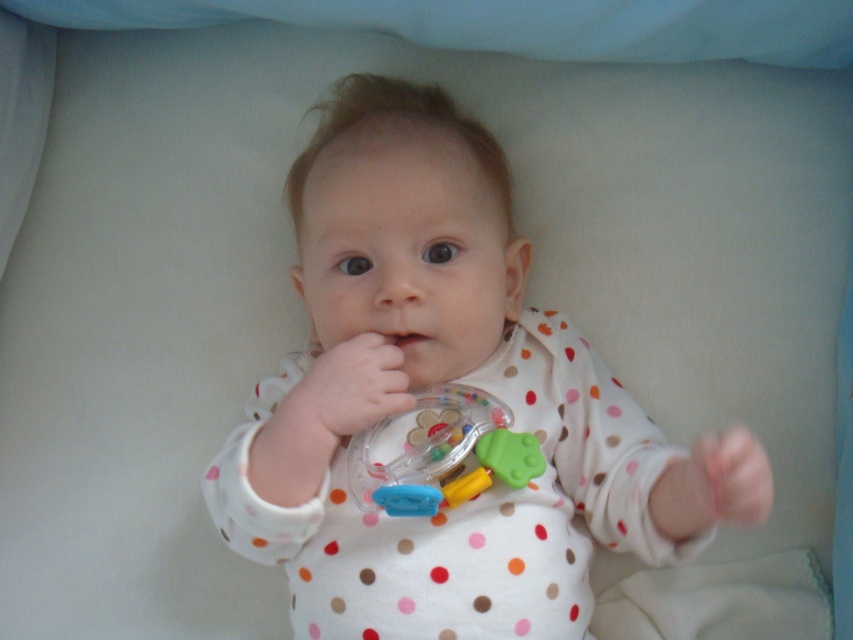
Question: Which is farther from the translucent plastic rattle at center?

Choices:
 (A) translucent plastic toy at center
 (B) pink rubber mouth at center

Answer: (B)

Question: Which object is closer to the camera taking this photo?

Choices:
 (A) white polka dot onesie at center
 (B) translucent plastic toy at center

Answer: (A)

Question: Is translucent plastic rattle at center smaller than pink rubber mouth at center?

Choices:
 (A) no
 (B) yes

Answer: (A)

Question: Based on their relative distances, which object is farther from the translucent plastic rattle at center?

Choices:
 (A) translucent plastic toy at center
 (B) pink rubber mouth at center
 (C) white polka dot onesie at center

Answer: (C)

Question: Does translucent plastic rattle at center have a greater width compared to pink rubber mouth at center?

Choices:
 (A) yes
 (B) no

Answer: (A)

Question: Does white polka dot onesie at center appear under pink rubber mouth at center?

Choices:
 (A) yes
 (B) no

Answer: (B)